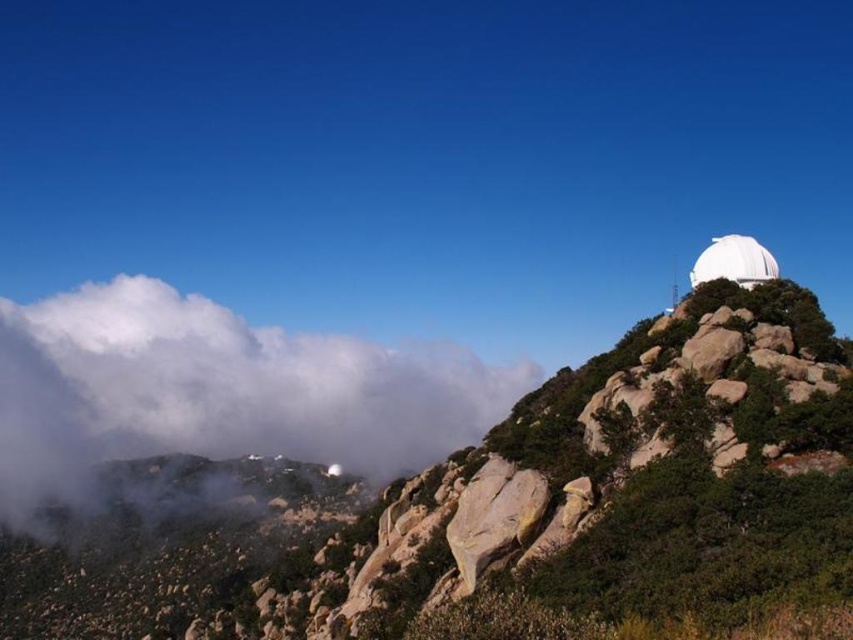
Who is positioned more to the right, smooth granite mountain at upper right or white fluffy cloud at upper left?

Positioned to the right is smooth granite mountain at upper right.

Which of these two, smooth granite mountain at upper right or white fluffy cloud at upper left, stands taller?

white fluffy cloud at upper left is taller.

I want to click on smooth granite mountain at upper right, so click(490, 508).

The width and height of the screenshot is (853, 640). Find the location of `smooth granite mountain at upper right`. smooth granite mountain at upper right is located at coordinates (490, 508).

Does point (401, 444) come farther from viewer compared to point (705, 273)?

Yes, point (401, 444) is farther from viewer.

You are a GUI agent. You are given a task and a screenshot of the screen. Output one action in this format:
    pyautogui.click(x=<x>, y=<y>)
    Task: Click on the white fluffy cloud at upper left
    
    Given the screenshot: What is the action you would take?
    pyautogui.click(x=218, y=390)

I want to click on white fluffy cloud at upper left, so click(218, 390).

Does smooth granite mountain at upper right come in front of white matte dome at upper right?

That is True.

Locate an element on the screen. smooth granite mountain at upper right is located at coordinates tap(490, 508).